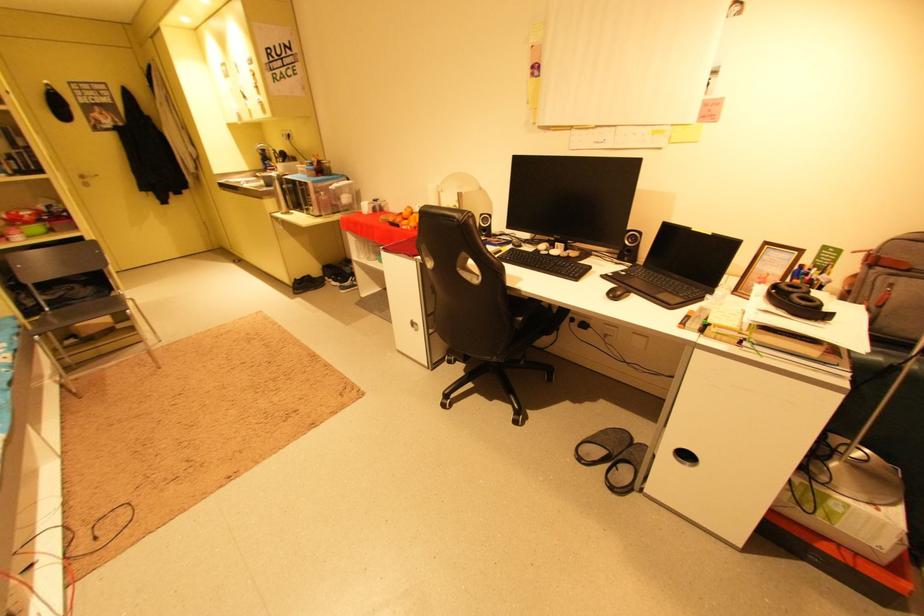
Identify the location of chair sitting surface. (524, 314).